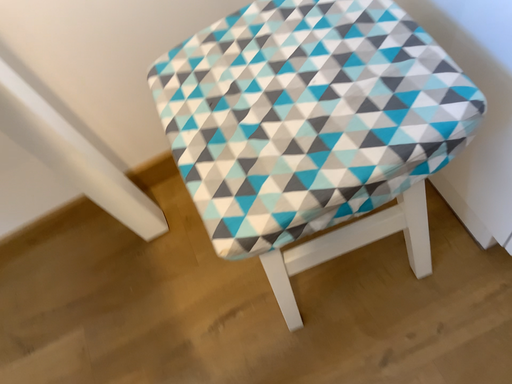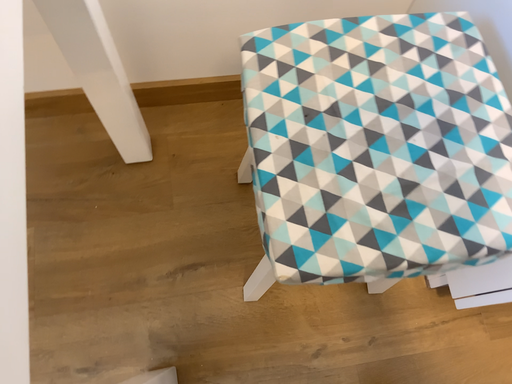
Question: How did the camera likely rotate when shooting the video?

Choices:
 (A) rotated downward
 (B) rotated upward

Answer: (A)